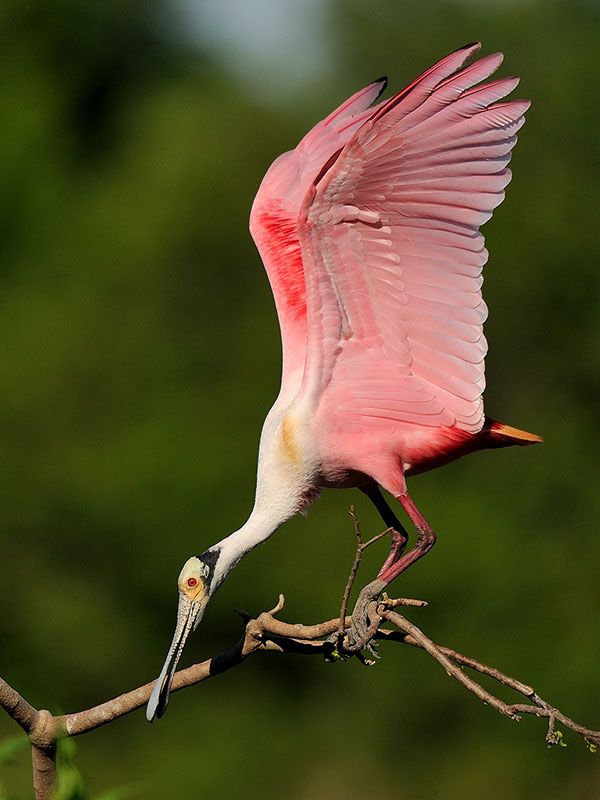
The image size is (600, 800). In order to click on chest in this screenshot , I will do `click(331, 470)`.